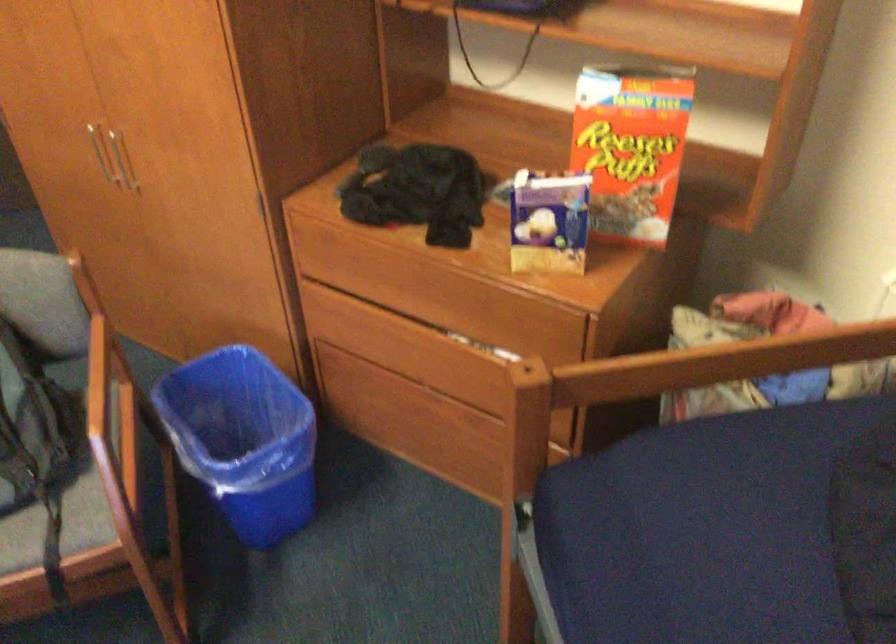
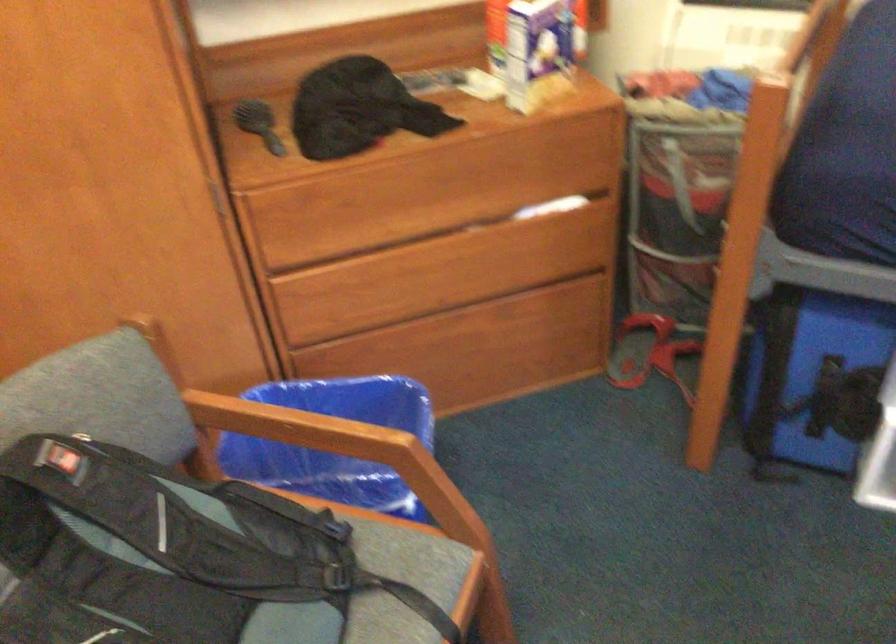
Question: I am providing you with two images of the same scene from different viewpoints. Please identify which objects are invisible in image2.

Choices:
 (A) blue trash can
 (B) blue plastic bin
 (C) drawer lock
 (D) wooden drawer edge

Answer: (A)